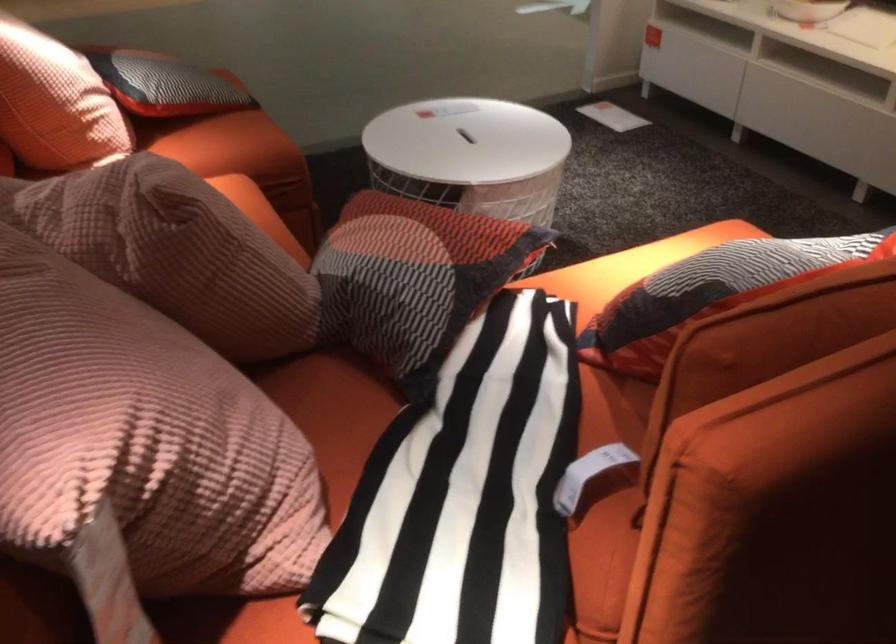
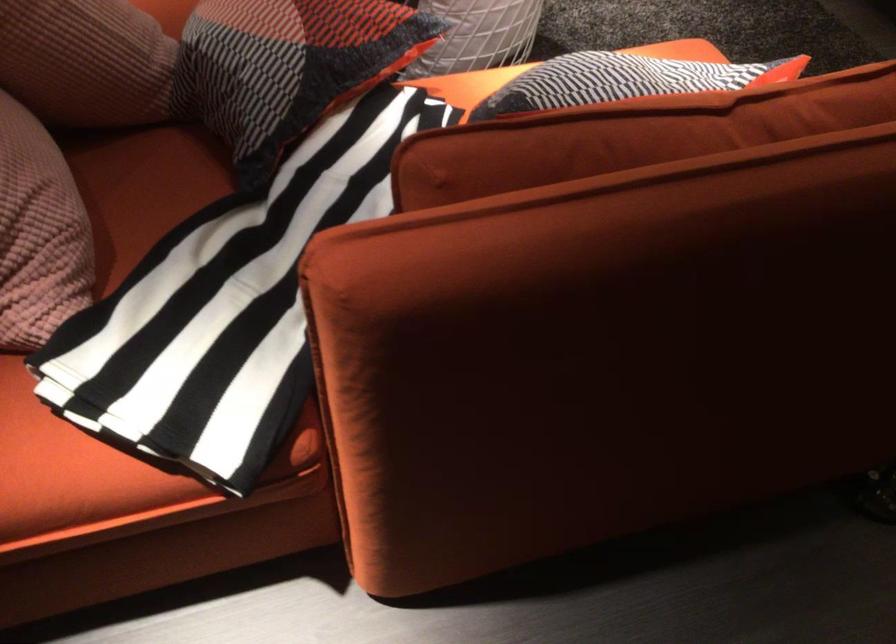
Find the pixel in the second image that matches point 317,415 in the first image.

(142, 187)